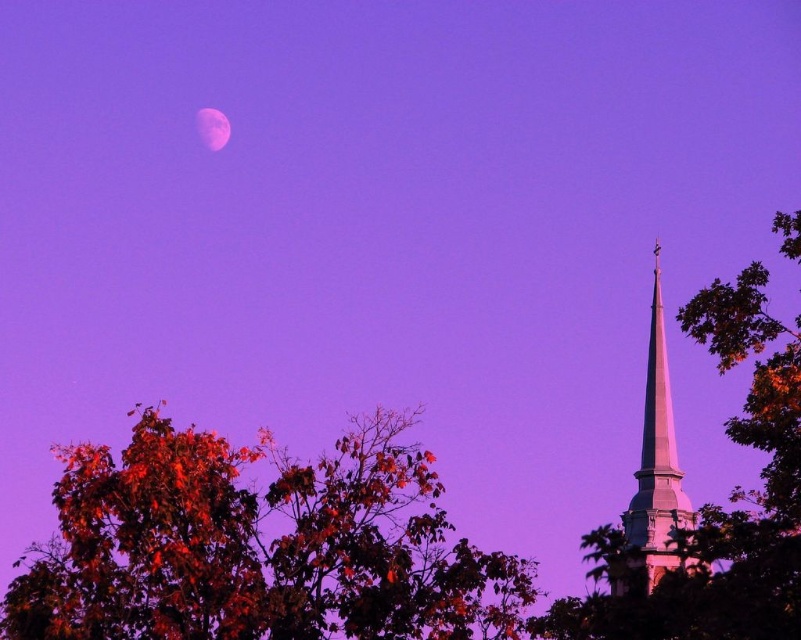
Question: Among these points, which one is nearest to the camera?

Choices:
 (A) [663, 545]
 (B) [180, 618]
 (C) [208, 147]

Answer: (A)

Question: Is reddish-brown foliage at lower left thinner than white smooth steeple at upper right?

Choices:
 (A) no
 (B) yes

Answer: (A)

Question: Which point is farther to the camera?

Choices:
 (A) (207, 132)
 (B) (624, 589)
 (C) (87, 544)

Answer: (A)

Question: Among these points, which one is farthest from the camera?

Choices:
 (A) (663, 356)
 (B) (761, 604)

Answer: (A)

Question: Observing the image, what is the correct spatial positioning of reddish-brown foliage at lower left in reference to pink translucent moon at upper center?

Choices:
 (A) right
 (B) left

Answer: (A)

Question: Is reddish-brown foliage at lower left closer to camera compared to pink translucent moon at upper center?

Choices:
 (A) yes
 (B) no

Answer: (A)